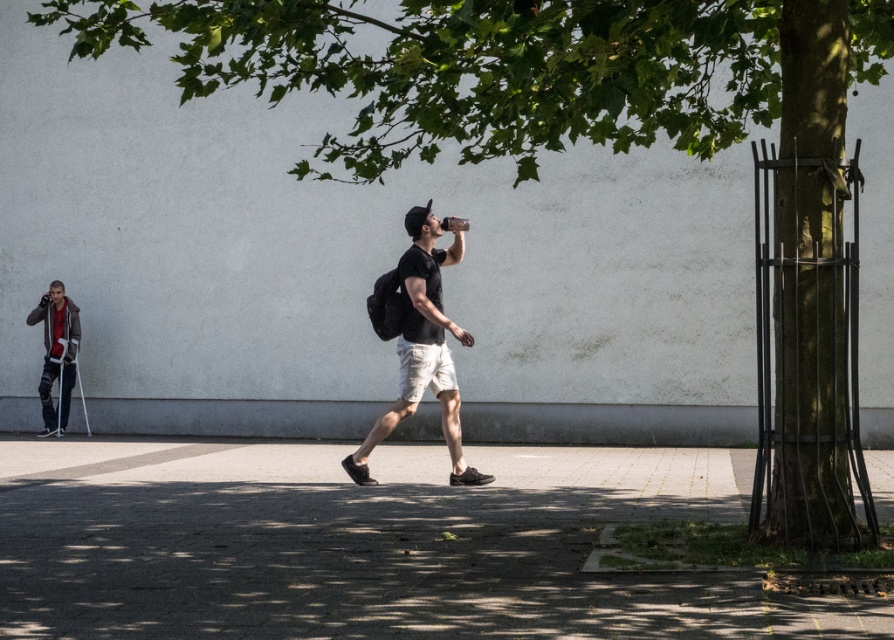
You are a delivery person who needs to place a small package on the ground. You see the gray concrete pavement at center and the matte black backpack at center. Which surface can accommodate the package more comfortably?

The gray concrete pavement at center has a larger size compared to the matte black backpack at center, so it can accommodate the package more comfortably.

You are standing on the gray concrete pavement at center and want to move towards the matte black backpack at center. Which direction should you move to reach it?

You should move to the left because the gray concrete pavement at center is to the right of the matte black backpack at center, so moving left will bring you closer to the backpack.

You are a delivery robot that needs to deliver a package to the person at the center of the image. The robot has a width of 0.8 meters. Can the robot pass through the space between the gray concrete pavement at center and the matte black backpack at center without touching either?

The gray concrete pavement at center is wider than the matte black backpack at center. Since the robot is 0.8 meters wide, it can pass through the space between them as long as the available width is sufficient. However, without specific measurements, we cannot confirm exact clearance. The description only states that the pavement is wider, but the actual passable space may vary.